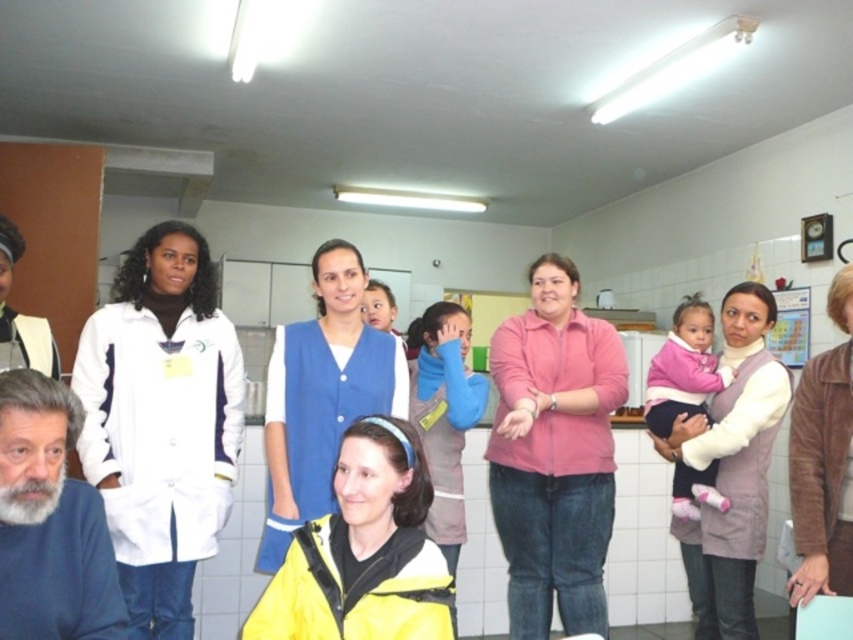
In the scene shown: You are a patient in a clinic and need to find the nearest healthcare professional. You see a white lab coat at center and a white matte lab coat at left. Which one is closer to you?

The white lab coat at center is closer to you because it is further to the viewer than the white matte lab coat at left, meaning it is positioned nearer in the visual perspective.